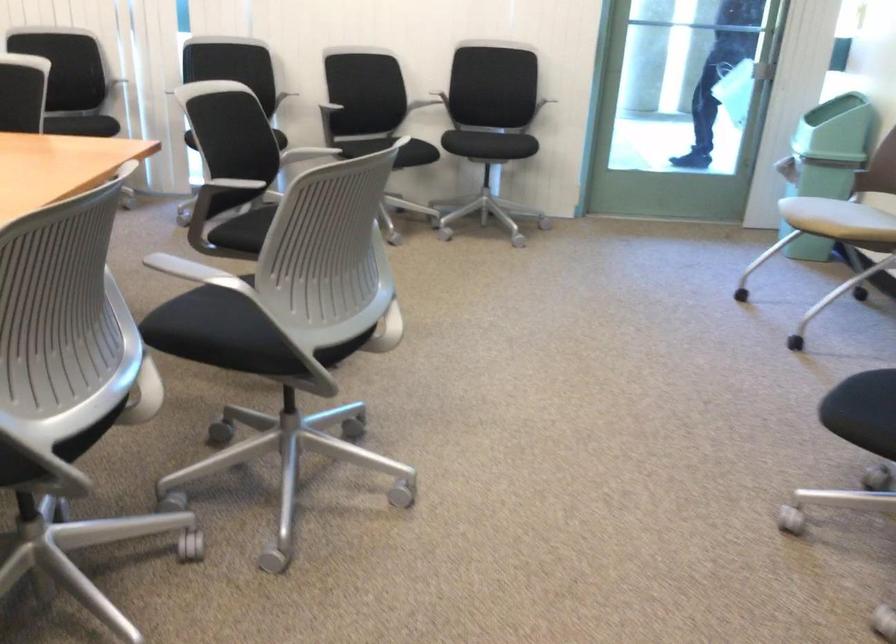
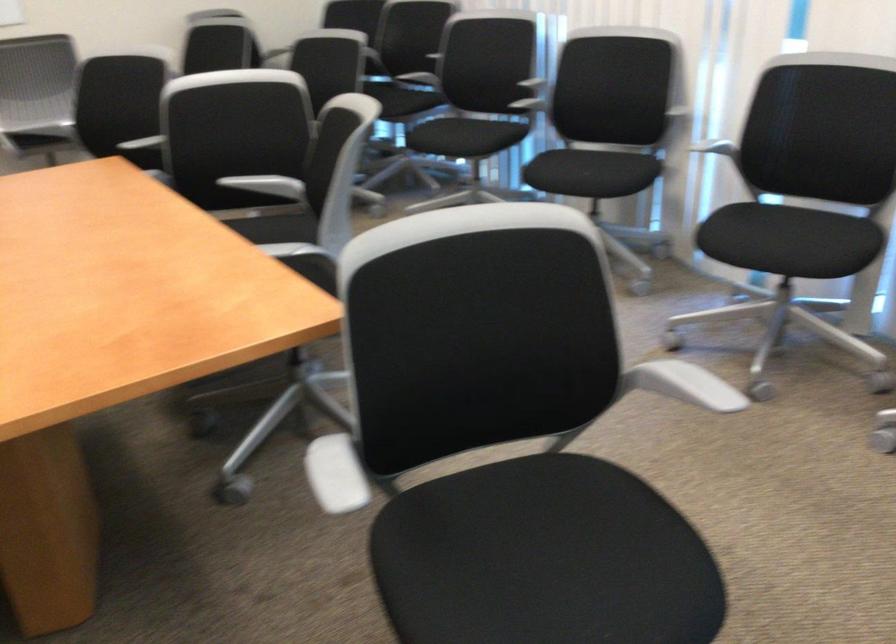
Find the pixel in the second image that matches point 87,109 in the first image.

(587, 174)